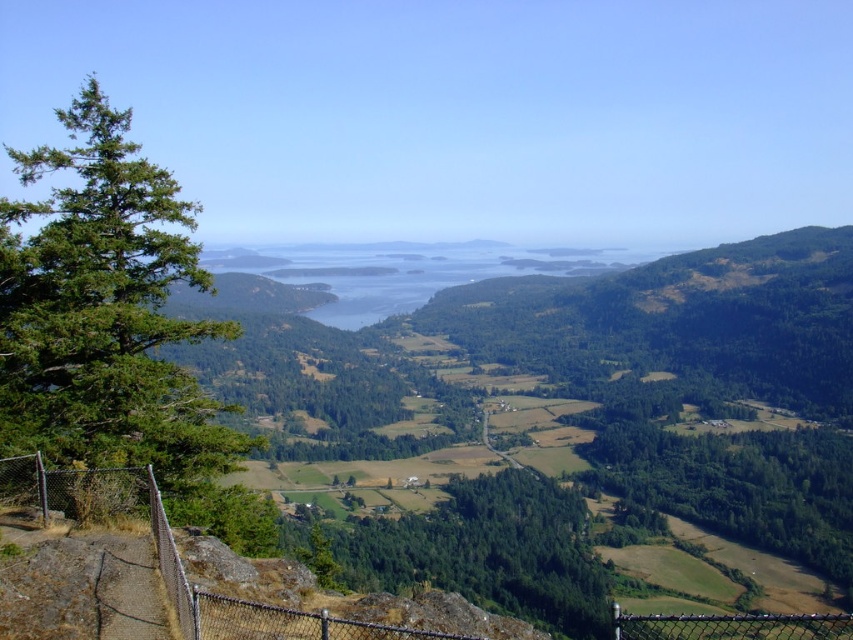
You are standing at a scenic overlook and want to take a photo. You notice two points marked in the scene at coordinates point [56,500] and point [732,632]. Which point is closer to your camera position?

Point [56,500] is further to the camera than point [732,632], so the point closer to the camera is point [732,632].